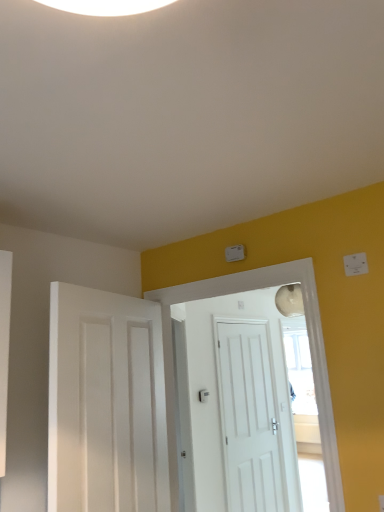
Question: Is white matte door at center, which is the second door from back to front, to the left of white plastic light switch at upper right from the viewer's perspective?

Choices:
 (A) yes
 (B) no

Answer: (A)

Question: Can white plastic light switch at upper right be found inside white matte door at center, acting as the second door starting from the front?

Choices:
 (A) no
 (B) yes

Answer: (A)

Question: Is white matte door at center, which is the second door from back to front, next to white plastic light switch at upper right?

Choices:
 (A) no
 (B) yes

Answer: (A)

Question: Does white matte door at center, which is the second door from back to front, have a lesser height compared to white plastic light switch at upper right?

Choices:
 (A) no
 (B) yes

Answer: (A)

Question: Is white matte door at center, which is the second door from back to front, not near white plastic light switch at upper right?

Choices:
 (A) yes
 (B) no

Answer: (B)

Question: Does white matte door at center, acting as the second door starting from the front, appear on the right side of white plastic light switch at upper right?

Choices:
 (A) no
 (B) yes

Answer: (A)

Question: Is white matte door at left, which is the first door in front-to-back order, far away from white matte door at center, acting as the second door starting from the front?

Choices:
 (A) yes
 (B) no

Answer: (B)

Question: From a real-world perspective, is white matte door at left, marked as the 3th door in a back-to-front arrangement, under white matte door at center, acting as the second door starting from the front?

Choices:
 (A) no
 (B) yes

Answer: (B)

Question: Is white matte door at left, marked as the 3th door in a back-to-front arrangement, in front of white matte door at center, acting as the second door starting from the front?

Choices:
 (A) yes
 (B) no

Answer: (A)

Question: From a real-world perspective, is white matte door at left, marked as the 3th door in a back-to-front arrangement, located higher than white matte door at center, which is the second door from back to front?

Choices:
 (A) yes
 (B) no

Answer: (B)

Question: Can you confirm if white matte door at left, which is the first door in front-to-back order, is positioned to the right of white matte door at center, acting as the second door starting from the front?

Choices:
 (A) yes
 (B) no

Answer: (B)

Question: Is white matte door at left, marked as the 3th door in a back-to-front arrangement, shorter than white matte door at center, which is the second door from back to front?

Choices:
 (A) yes
 (B) no

Answer: (A)

Question: Does white plastic light switch at upper right appear on the left side of white matte door at center, acting as the second door starting from the front?

Choices:
 (A) no
 (B) yes

Answer: (A)